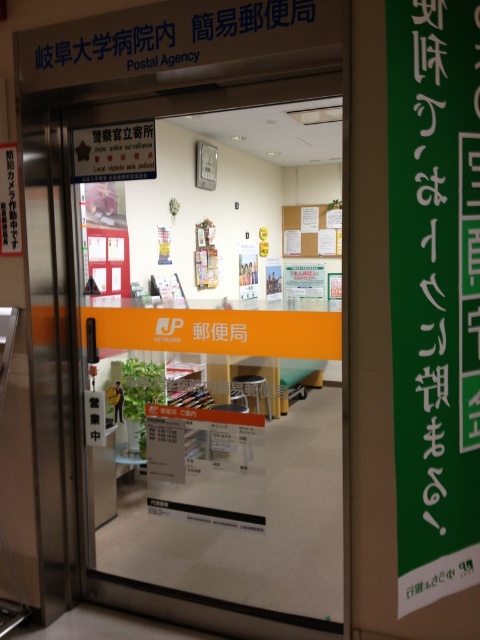
You are a delivery person standing at the entrance of the postal agency. You need to place a large package that is 6 meters long between the transparent glass door at center and the green paper at center. Is there enough space to place the package without bending it?

The distance between the transparent glass door at center and the green paper at center is 5.75 meters, which is shorter than the 6 meters length of the package. Therefore, there is not enough space to place the package without bending it.

You are a delivery person trying to hand over a package to the postal agency. You see the transparent glass door at center and the green paper at center. Which object is taller?

The green paper at center is taller than the transparent glass door at center.

You are standing in front of the entrance to the postal agency at Gifu University Hospital. You need to enter the building but notice the transparent glass door at center. Where exactly is the transparent glass door located in relation to the other signs on the door?

The transparent glass door at center is located at point (223,358), which places it centrally on the door, positioned between the security sign on the left and the JP Network logo on the orange sign below it.